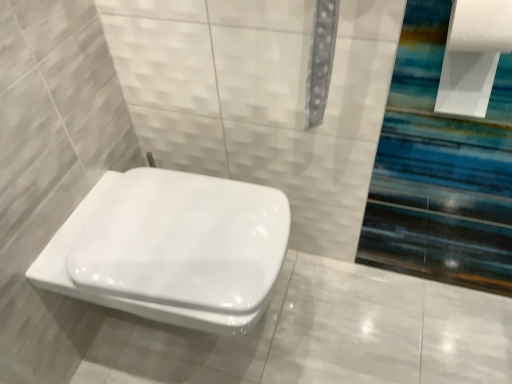
Where is `white paper at upper right`? white paper at upper right is located at coordinates (473, 55).

Describe the element at coordinates (473, 55) in the screenshot. I see `white paper at upper right` at that location.

This screenshot has width=512, height=384. What are the coordinates of `white glossy toilet at center` in the screenshot? It's located at (170, 249).

The width and height of the screenshot is (512, 384). Describe the element at coordinates (170, 249) in the screenshot. I see `white glossy toilet at center` at that location.

Identify the location of white paper at upper right. (473, 55).

Is white paper at upper right to the left of white glossy toilet at center from the viewer's perspective?

In fact, white paper at upper right is to the right of white glossy toilet at center.

Considering the relative positions of white paper at upper right and white glossy toilet at center in the image provided, is white paper at upper right behind white glossy toilet at center?

No, white paper at upper right is in front of white glossy toilet at center.

Which is less distant, (489, 63) or (262, 199)?

Point (489, 63) is closer to the camera than point (262, 199).

In the scene shown: From the image's perspective, is white paper at upper right above white glossy toilet at center?

Yes, from the image's perspective, white paper at upper right is above white glossy toilet at center.

From a real-world perspective, is white paper at upper right on white glossy toilet at center?

Yes, from a real-world perspective, white paper at upper right is over white glossy toilet at center

Is white paper at upper right thinner than white glossy toilet at center?

Correct, the width of white paper at upper right is less than that of white glossy toilet at center.

Who is shorter, white paper at upper right or white glossy toilet at center?

With less height is white paper at upper right.

In the scene shown: Does white paper at upper right have a larger size compared to white glossy toilet at center?

Actually, white paper at upper right might be smaller than white glossy toilet at center.

Is white paper at upper right not within white glossy toilet at center?

Yes, white paper at upper right is located beyond the bounds of white glossy toilet at center.

Are white paper at upper right and white glossy toilet at center making contact?

No, white paper at upper right is not making contact with white glossy toilet at center.

Is white paper at upper right oriented away from white glossy toilet at center?

No, white paper at upper right is not facing away from white glossy toilet at center.

Locate an element on the screen. This screenshot has height=384, width=512. toilet paper to the right of white glossy toilet at center is located at coordinates (473, 55).

Considering the relative positions of white glossy toilet at center and white paper at upper right in the image provided, is white glossy toilet at center to the left or to the right of white paper at upper right?

white glossy toilet at center is to the left of white paper at upper right.

Considering the positions of objects white glossy toilet at center and white paper at upper right in the image provided, who is in front, white glossy toilet at center or white paper at upper right?

white paper at upper right is more forward.

Which is behind, point (223, 251) or point (507, 37)?

The point (223, 251) is more distant.

From the image's perspective, is white glossy toilet at center on top of white paper at upper right?

No, from the image's perspective, white glossy toilet at center is not on top of white paper at upper right.

From a real-world perspective, is white glossy toilet at center physically below white paper at upper right?

Yes, from a real-world perspective, white glossy toilet at center is under white paper at upper right.

Between white glossy toilet at center and white paper at upper right, which one has smaller width?

white paper at upper right.

Considering the sizes of objects white glossy toilet at center and white paper at upper right in the image provided, who is shorter, white glossy toilet at center or white paper at upper right?

Standing shorter between the two is white paper at upper right.

Which of these two, white glossy toilet at center or white paper at upper right, is bigger?

Bigger between the two is white glossy toilet at center.

Would you say white glossy toilet at center contains white paper at upper right?

Definitely not — white paper at upper right is not inside white glossy toilet at center.

Is white glossy toilet at center not close to white paper at upper right?

They are positioned close to each other.

Is white glossy toilet at center oriented towards white paper at upper right?

No, white glossy toilet at center is not turned towards white paper at upper right.

Can you tell me how much white glossy toilet at center and white paper at upper right differ in facing direction?

There is a 88.2-degree angle between the facing directions of white glossy toilet at center and white paper at upper right.

Image resolution: width=512 pixels, height=384 pixels. Find the location of `toilet paper above the white glossy toilet at center (from the image's perspective)`. toilet paper above the white glossy toilet at center (from the image's perspective) is located at coordinates (473, 55).

Identify the location of toilet below the white paper at upper right (from a real-world perspective). (170, 249).

Where is `toilet lying below the white paper at upper right (from the image's perspective)`? Image resolution: width=512 pixels, height=384 pixels. toilet lying below the white paper at upper right (from the image's perspective) is located at coordinates (170, 249).